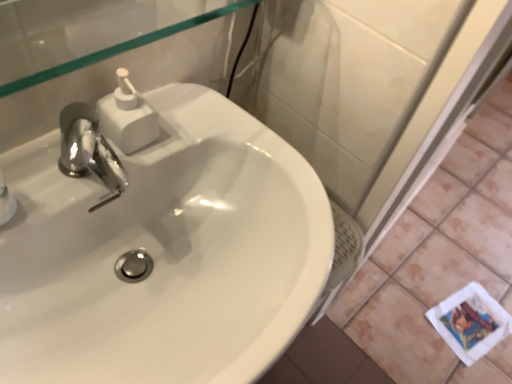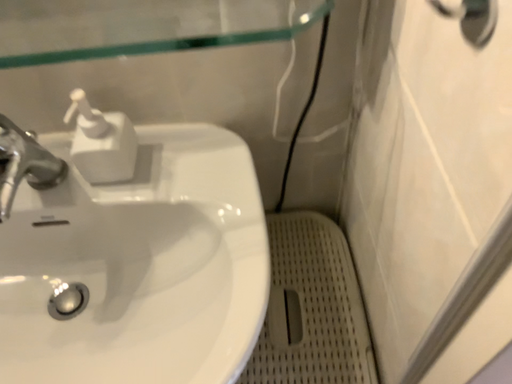
Question: How did the camera likely rotate when shooting the video?

Choices:
 (A) rotated right
 (B) rotated left

Answer: (B)